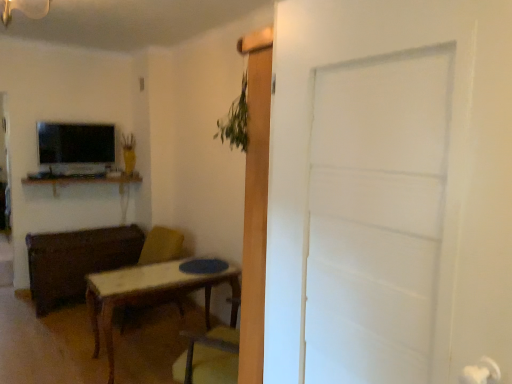
Question: Can you confirm if wooden desk at upper left is positioned to the right of white matte door at center?

Choices:
 (A) yes
 (B) no

Answer: (B)

Question: Is wooden desk at upper left next to white matte door at center and touching it?

Choices:
 (A) no
 (B) yes

Answer: (A)

Question: Can you confirm if wooden desk at upper left is positioned to the left of white matte door at center?

Choices:
 (A) no
 (B) yes

Answer: (B)

Question: Does wooden desk at upper left contain white matte door at center?

Choices:
 (A) no
 (B) yes

Answer: (A)

Question: Does wooden desk at upper left have a greater height compared to white matte door at center?

Choices:
 (A) no
 (B) yes

Answer: (A)

Question: Considering the relative sizes of wooden desk at upper left and white matte door at center in the image provided, is wooden desk at upper left bigger than white matte door at center?

Choices:
 (A) yes
 (B) no

Answer: (B)

Question: Considering the relative sizes of matte black tv at upper left and matte wood chest at left in the image provided, is matte black tv at upper left smaller than matte wood chest at left?

Choices:
 (A) no
 (B) yes

Answer: (B)

Question: Considering the relative sizes of matte black tv at upper left and matte wood chest at left in the image provided, is matte black tv at upper left wider than matte wood chest at left?

Choices:
 (A) yes
 (B) no

Answer: (B)

Question: From the image's perspective, would you say matte black tv at upper left is shown under matte wood chest at left?

Choices:
 (A) no
 (B) yes

Answer: (A)

Question: Considering the relative sizes of matte black tv at upper left and matte wood chest at left in the image provided, is matte black tv at upper left taller than matte wood chest at left?

Choices:
 (A) no
 (B) yes

Answer: (A)

Question: Is matte black tv at upper left beside matte wood chest at left?

Choices:
 (A) no
 (B) yes

Answer: (A)

Question: Is matte black tv at upper left surrounding matte wood chest at left?

Choices:
 (A) no
 (B) yes

Answer: (A)

Question: Considering the relative sizes of matte black tv at upper left and wooden desk at upper left in the image provided, is matte black tv at upper left shorter than wooden desk at upper left?

Choices:
 (A) yes
 (B) no

Answer: (B)